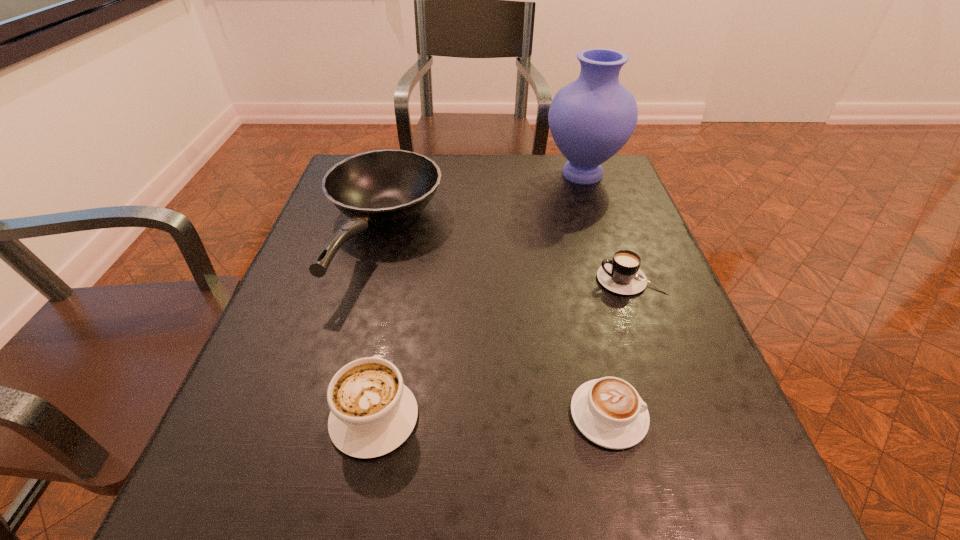
Identify the location of vacant area between the frying pan and the vase. This screenshot has height=540, width=960. (482, 205).

The height and width of the screenshot is (540, 960). I want to click on vacant space in between the farthest cappuccino and the third shortest object, so click(502, 348).

Locate an element on the screen. free space between the vase and the second tallest object is located at coordinates (482, 205).

You are a GUI agent. You are given a task and a screenshot of the screen. Output one action in this format:
    pyautogui.click(x=<x>, y=<y>)
    Task: Click on the vacant space in between the tallest object and the leftmost cappuccino
    
    Given the screenshot: What is the action you would take?
    pyautogui.click(x=478, y=295)

Locate an element on the screen. vacant space in between the tallest object and the leftmost cappuccino is located at coordinates (478, 295).

Point out which object is positioned as the second nearest to the farthest cappuccino. Please provide its 2D coordinates. Your answer should be formatted as a tuple, i.e. [(x, y)], where the tuple contains the x and y coordinates of a point satisfying the conditions above.

[(590, 119)]

Identify which object is the second nearest to the frying pan. Please provide its 2D coordinates. Your answer should be formatted as a tuple, i.e. [(x, y)], where the tuple contains the x and y coordinates of a point satisfying the conditions above.

[(590, 119)]

At what (x,y) coordinates should I click in order to perform the action: click on cappuccino that can be found as the closest to the third tallest object. Please return your answer as a coordinate pair (x, y). This screenshot has height=540, width=960. Looking at the image, I should click on (608, 411).

Where is `cappuccino that is the closest one to the third tallest object`? This screenshot has width=960, height=540. cappuccino that is the closest one to the third tallest object is located at coordinates (608, 411).

Where is `free space that satisfies the following two spatial constraints: 1. to the right of the leftmost cappuccino's handle; 2. on the right side of the vase`? This screenshot has height=540, width=960. free space that satisfies the following two spatial constraints: 1. to the right of the leftmost cappuccino's handle; 2. on the right side of the vase is located at coordinates (420, 174).